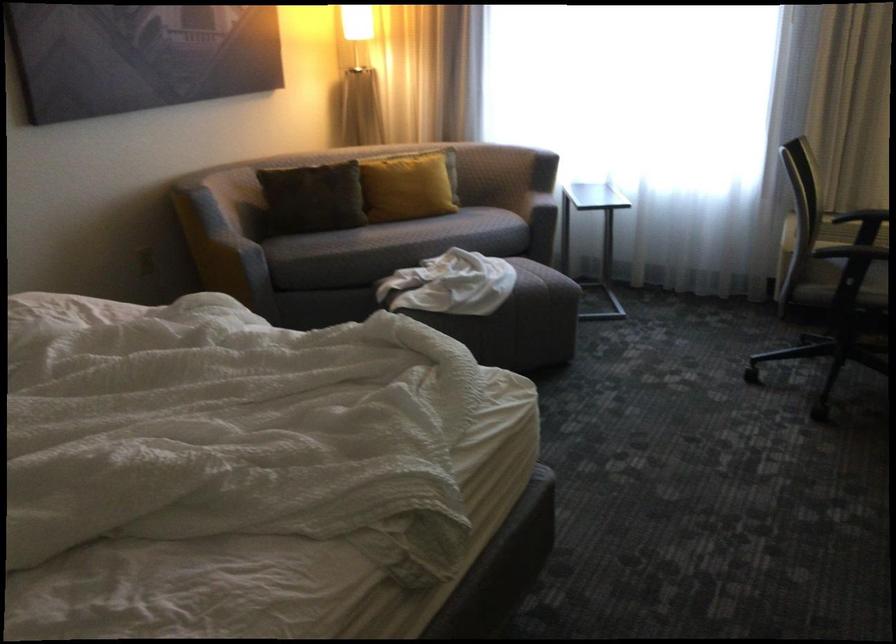
In order to click on dark brown pillow in this screenshot , I will do `click(314, 196)`.